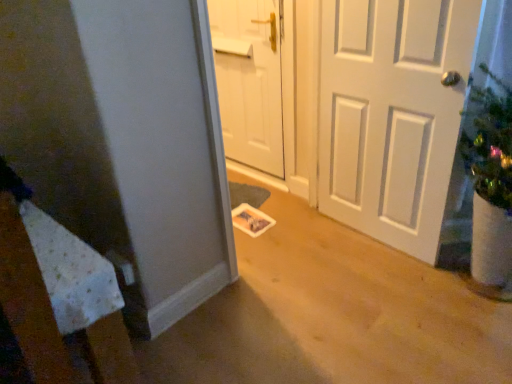
Find the location of a particular element. The height and width of the screenshot is (384, 512). white matte door at right, the 2th door from the left is located at coordinates (392, 114).

What do you see at coordinates (392, 114) in the screenshot?
I see `white matte door at right, which ranks as the 1th door in right-to-left order` at bounding box center [392, 114].

Describe the element at coordinates (249, 81) in the screenshot. I see `white matte door at center, which appears as the 2th door when viewed from the right` at that location.

Measure the distance between point (272, 16) and camera.

The depth of point (272, 16) is 2.33 meters.

Identify the location of white matte door at center, placed as the 1th door when sorted from left to right. Image resolution: width=512 pixels, height=384 pixels. pyautogui.click(x=249, y=81).

The height and width of the screenshot is (384, 512). I want to click on white matte door at right, which ranks as the 1th door in right-to-left order, so click(x=392, y=114).

Which object is positioned more to the right, white matte door at right, which ranks as the 1th door in right-to-left order, or white matte door at center, placed as the 1th door when sorted from left to right?

white matte door at right, which ranks as the 1th door in right-to-left order.

Which object is further away from the camera taking this photo, white matte door at right, which ranks as the 1th door in right-to-left order, or white matte door at center, placed as the 1th door when sorted from left to right?

white matte door at center, placed as the 1th door when sorted from left to right, is behind.

Is point (414, 115) less distant than point (228, 66)?

Yes, it is in front of point (228, 66).

From the image's perspective, which one is positioned higher, white matte door at right, which ranks as the 1th door in right-to-left order, or white matte door at center, placed as the 1th door when sorted from left to right?

white matte door at center, placed as the 1th door when sorted from left to right, appears higher in the image.

From a real-world perspective, which object rests below the other?

In real-world perspective, white matte door at center, which appears as the 2th door when viewed from the right, is lower.

From the picture: Considering the relative sizes of white matte door at right, which ranks as the 1th door in right-to-left order, and white matte door at center, placed as the 1th door when sorted from left to right, in the image provided, is white matte door at right, which ranks as the 1th door in right-to-left order, wider than white matte door at center, placed as the 1th door when sorted from left to right,?

Yes, white matte door at right, which ranks as the 1th door in right-to-left order, is wider than white matte door at center, placed as the 1th door when sorted from left to right.

Considering the relative sizes of white matte door at right, the 2th door from the left, and white matte door at center, which appears as the 2th door when viewed from the right, in the image provided, is white matte door at right, the 2th door from the left, shorter than white matte door at center, which appears as the 2th door when viewed from the right,?

Incorrect, the height of white matte door at right, the 2th door from the left, does not fall short of that of white matte door at center, which appears as the 2th door when viewed from the right.

In terms of size, does white matte door at right, the 2th door from the left, appear bigger or smaller than white matte door at center, which appears as the 2th door when viewed from the right?

Clearly, white matte door at right, the 2th door from the left, is larger in size than white matte door at center, which appears as the 2th door when viewed from the right.

Is white matte door at right, the 2th door from the left, situated inside white matte door at center, which appears as the 2th door when viewed from the right, or outside?

white matte door at right, the 2th door from the left, cannot be found inside white matte door at center, which appears as the 2th door when viewed from the right.

Is white matte door at right, which ranks as the 1th door in right-to-left order, not near white matte door at center, placed as the 1th door when sorted from left to right?

No, there isn't a large distance between white matte door at right, which ranks as the 1th door in right-to-left order, and white matte door at center, placed as the 1th door when sorted from left to right.

Is white matte door at center, placed as the 1th door when sorted from left to right, at the back of white matte door at right, which ranks as the 1th door in right-to-left order?

That's not correct — white matte door at right, which ranks as the 1th door in right-to-left order, is not looking away from white matte door at center, placed as the 1th door when sorted from left to right.

How different are the orientations of white matte door at right, which ranks as the 1th door in right-to-left order, and white matte door at center, placed as the 1th door when sorted from left to right, in degrees?

The angle between the facing direction of white matte door at right, which ranks as the 1th door in right-to-left order, and the facing direction of white matte door at center, placed as the 1th door when sorted from left to right, is 4.64 degrees.

Find the location of a particular element. Image resolution: width=512 pixels, height=384 pixels. door behind the white matte door at right, the 2th door from the left is located at coordinates coord(249,81).

From the picture: Can you confirm if white matte door at center, placed as the 1th door when sorted from left to right, is positioned to the right of white matte door at right, which ranks as the 1th door in right-to-left order?

No, white matte door at center, placed as the 1th door when sorted from left to right, is not to the right of white matte door at right, which ranks as the 1th door in right-to-left order.

Relative to white matte door at right, the 2th door from the left, is white matte door at center, placed as the 1th door when sorted from left to right, in front or behind?

Visually, white matte door at center, placed as the 1th door when sorted from left to right, is located behind white matte door at right, the 2th door from the left.

Between point (226, 93) and point (437, 162), which one is positioned behind?

The point (226, 93) is more distant.

From the image's perspective, does white matte door at center, which appears as the 2th door when viewed from the right, appear higher than white matte door at right, the 2th door from the left?

Yes, from the image's perspective, white matte door at center, which appears as the 2th door when viewed from the right, is above white matte door at right, the 2th door from the left.

From a real-world perspective, is white matte door at center, which appears as the 2th door when viewed from the right, below white matte door at right, which ranks as the 1th door in right-to-left order?

Yes, from a real-world perspective, white matte door at center, which appears as the 2th door when viewed from the right, is beneath white matte door at right, which ranks as the 1th door in right-to-left order.

Is white matte door at center, placed as the 1th door when sorted from left to right, thinner than white matte door at right, the 2th door from the left?

Correct, the width of white matte door at center, placed as the 1th door when sorted from left to right, is less than that of white matte door at right, the 2th door from the left.

Is white matte door at center, which appears as the 2th door when viewed from the right, taller or shorter than white matte door at right, the 2th door from the left?

Considering their sizes, white matte door at center, which appears as the 2th door when viewed from the right, has less height than white matte door at right, the 2th door from the left.

Considering the sizes of objects white matte door at center, placed as the 1th door when sorted from left to right, and white matte door at right, which ranks as the 1th door in right-to-left order, in the image provided, who is smaller, white matte door at center, placed as the 1th door when sorted from left to right, or white matte door at right, which ranks as the 1th door in right-to-left order,?

white matte door at center, placed as the 1th door when sorted from left to right.

Is white matte door at center, placed as the 1th door when sorted from left to right, inside or outside of white matte door at right, the 2th door from the left?

white matte door at center, placed as the 1th door when sorted from left to right, is located beyond the bounds of white matte door at right, the 2th door from the left.

Is white matte door at center, placed as the 1th door when sorted from left to right, next to white matte door at right, which ranks as the 1th door in right-to-left order?

white matte door at center, placed as the 1th door when sorted from left to right, and white matte door at right, which ranks as the 1th door in right-to-left order, are not in contact.

Is white matte door at center, placed as the 1th door when sorted from left to right, aimed at white matte door at right, which ranks as the 1th door in right-to-left order?

No.

Measure the distance from white matte door at center, placed as the 1th door when sorted from left to right, to white matte door at right, the 2th door from the left.

A distance of 28.55 inches exists between white matte door at center, placed as the 1th door when sorted from left to right, and white matte door at right, the 2th door from the left.

Locate an element on the screen. This screenshot has height=384, width=512. door directly beneath the white matte door at right, which ranks as the 1th door in right-to-left order (from a real-world perspective) is located at coordinates (249, 81).

In the image, there is a white matte door at right, the 2th door from the left. At what (x,y) coordinates should I click in order to perform the action: click on door above it (from the image's perspective). Please return your answer as a coordinate pair (x, y). Looking at the image, I should click on (249, 81).

Find the location of `door behind the white matte door at right, the 2th door from the left`. door behind the white matte door at right, the 2th door from the left is located at coordinates (249, 81).